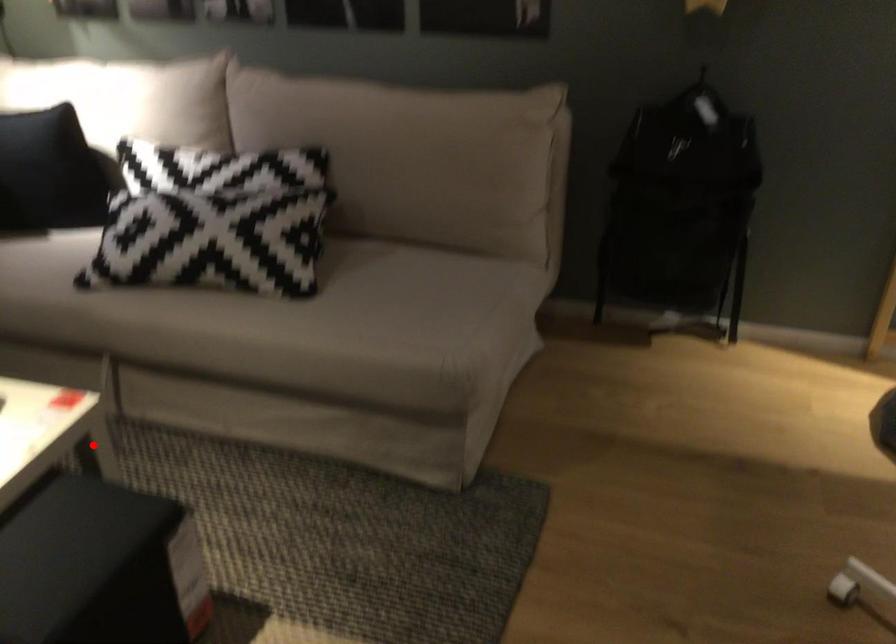
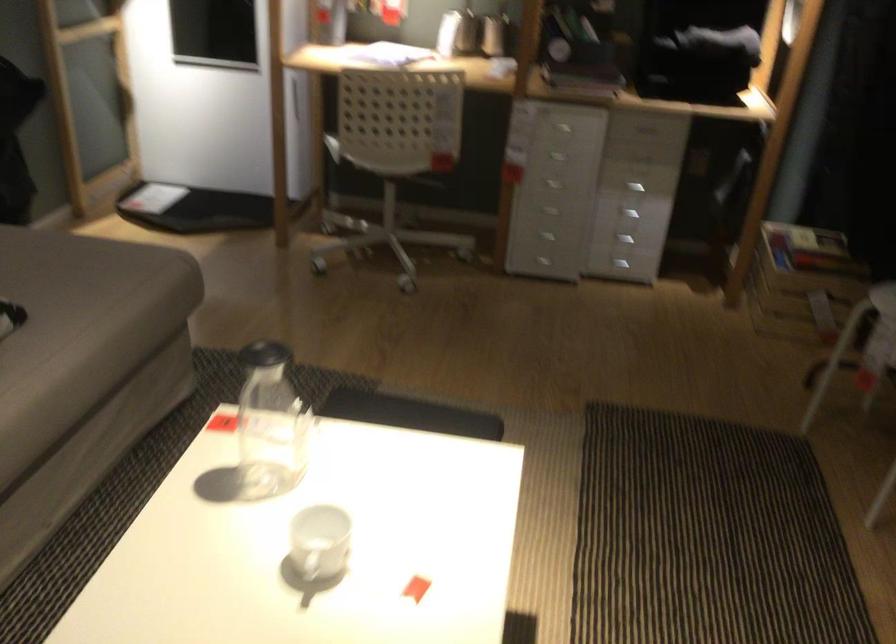
The point at the highlighted location is marked in the first image. Where is the corresponding point in the second image?

(270, 424)